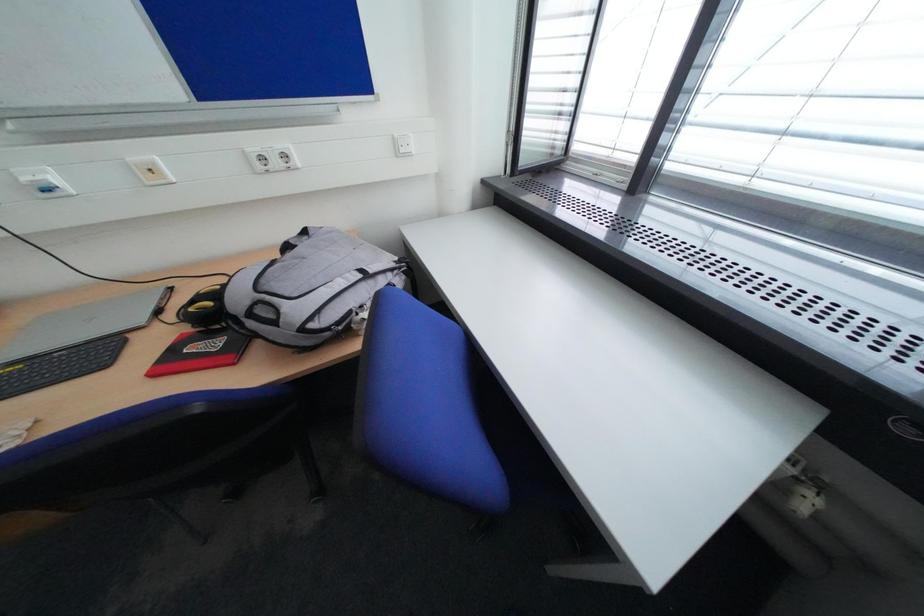
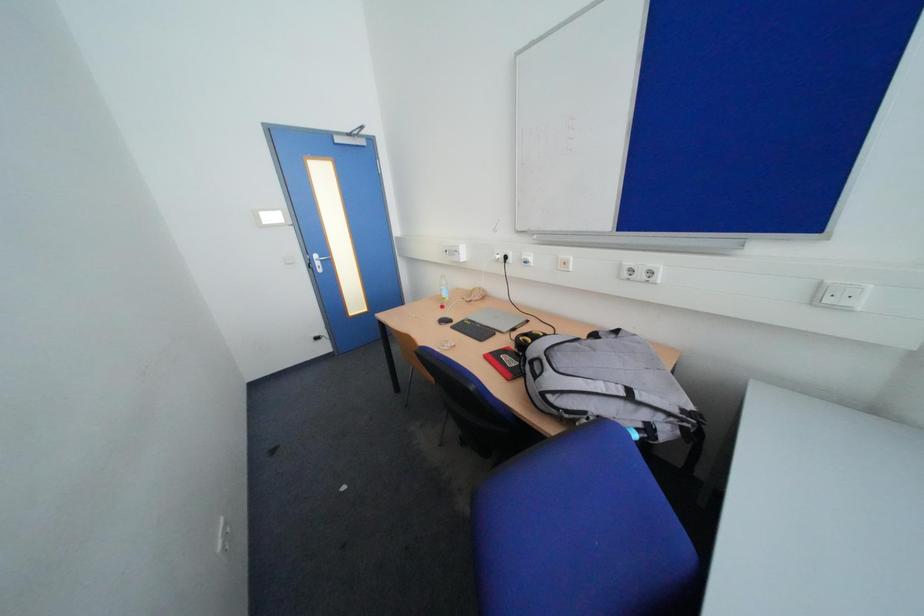
Question: How did the camera likely rotate?

Choices:
 (A) Left
 (B) Right
 (C) Up
 (D) Down

Answer: (A)